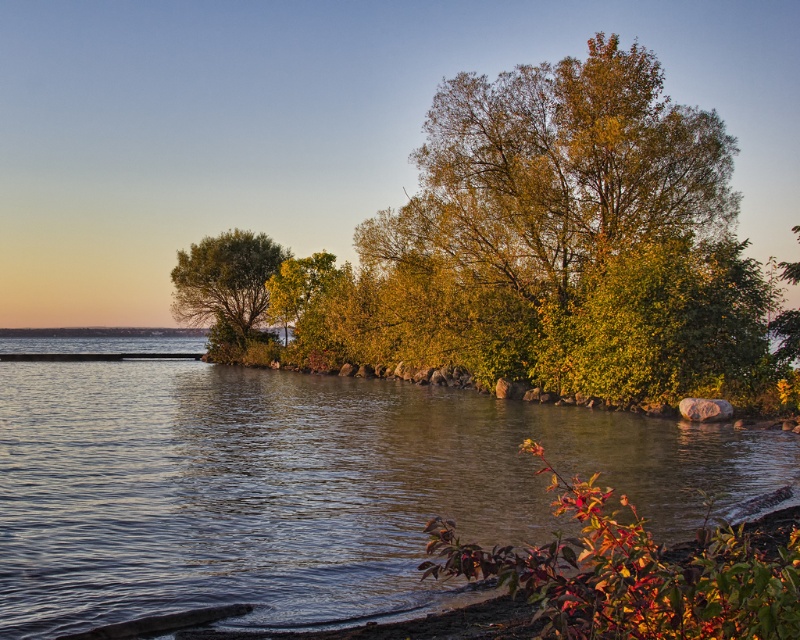
Does point (654, 250) come in front of point (208, 308)?

Yes, it is in front of point (208, 308).

Which is in front, point (668, 317) or point (237, 285)?

Point (668, 317)

What do you see at coordinates (558, 244) in the screenshot? This screenshot has height=640, width=800. I see `green leafy tree at center` at bounding box center [558, 244].

What are the coordinates of `green leafy tree at center` in the screenshot? It's located at (558, 244).

Between point (54, 364) and point (636, 83), which one is positioned in front?

Positioned in front is point (636, 83).

Is point (548, 493) in front of point (428, 224)?

Yes, it is.

Locate an element on the screen. The height and width of the screenshot is (640, 800). clear water at center is located at coordinates (304, 486).

Between clear water at center and green matte tree at center-left, which one appears on the left side from the viewer's perspective?

Positioned to the left is green matte tree at center-left.

This screenshot has width=800, height=640. What do you see at coordinates (304, 486) in the screenshot?
I see `clear water at center` at bounding box center [304, 486].

Is point (12, 477) positioned after point (276, 262)?

No.

This screenshot has width=800, height=640. What are the coordinates of `clear water at center` in the screenshot? It's located at (304, 486).